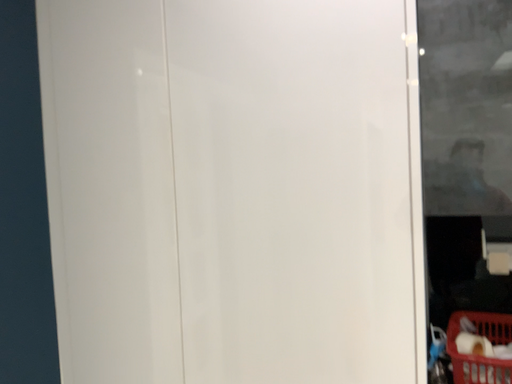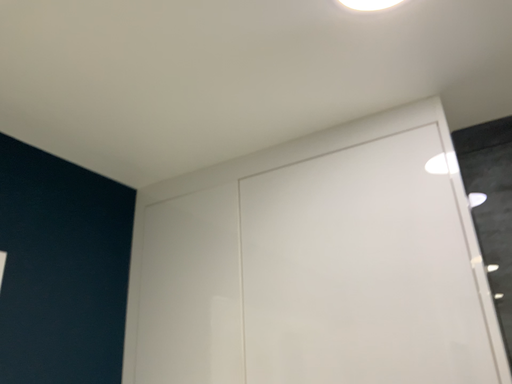
Question: Which way did the camera rotate in the video?

Choices:
 (A) rotated right
 (B) rotated left

Answer: (B)